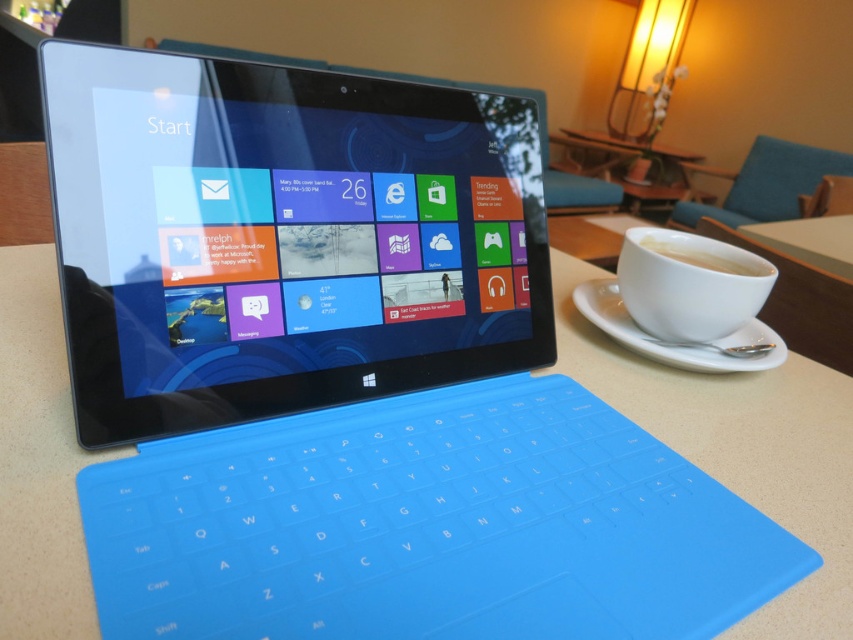
Between white ceramic saucer at right and white matte cup at right, which one is positioned higher?

Positioned higher is white matte cup at right.

Is white ceramic saucer at right wider than white matte cup at right?

Yes.

Between point (753, 356) and point (718, 260), which one is positioned in front?

Positioned in front is point (753, 356).

The image size is (853, 640). What are the coordinates of `white ceramic saucer at right` in the screenshot? It's located at (675, 340).